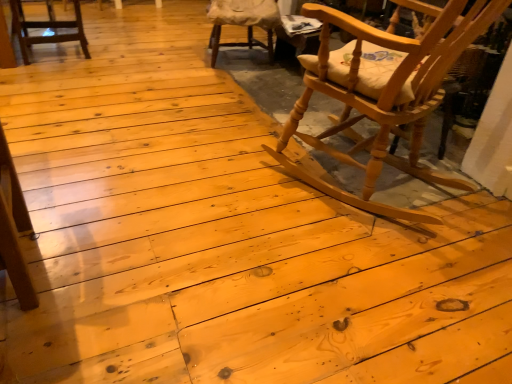
Question: Visually, is wooden cushioned chair at upper center, placed as the first chair when sorted from back to front, positioned to the left or to the right of natural wood rocking chair at right, which is the third chair from left to right?

Choices:
 (A) right
 (B) left

Answer: (B)

Question: Looking at the image, does wooden cushioned chair at upper center, positioned as the second chair in right-to-left order, seem bigger or smaller compared to natural wood rocking chair at right, which is the third chair from left to right?

Choices:
 (A) small
 (B) big

Answer: (A)

Question: Which of these objects is positioned farthest from the matte wood chair at upper left, which is the 3th chair in right-to-left order?

Choices:
 (A) natural wood rocking chair at right, acting as the 1th chair starting from the right
 (B) wooden cushioned chair at upper center, arranged as the third chair when viewed from the front

Answer: (A)

Question: Considering the real-world distances, which object is closest to the matte wood chair at upper left, the 2th chair in the front-to-back sequence?

Choices:
 (A) wooden cushioned chair at upper center, placed as the first chair when sorted from back to front
 (B) natural wood rocking chair at right, acting as the 1th chair starting from the right

Answer: (A)